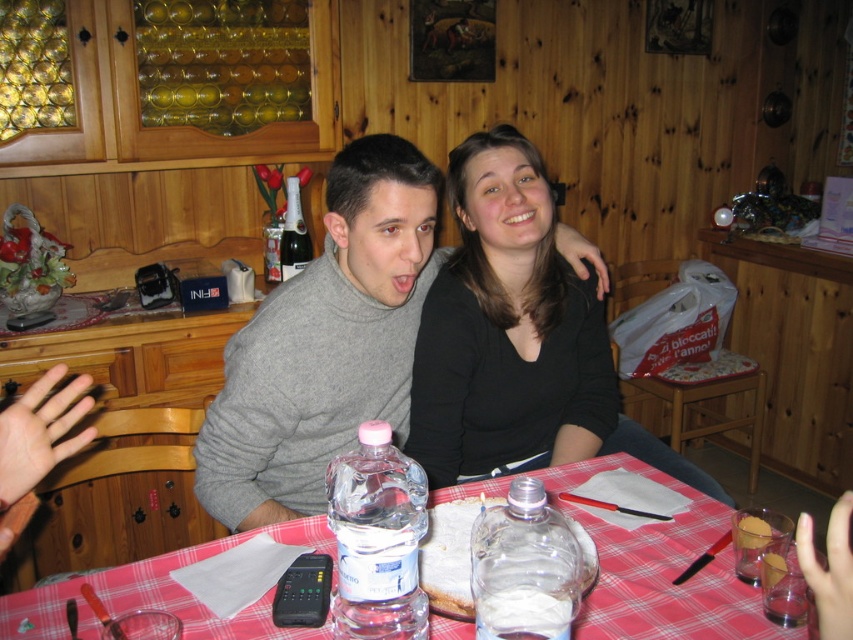
Does point (563, 628) come in front of point (305, 227)?

That is True.

Can you confirm if clear plastic bottle at table center is positioned to the left of black glass bottle at center?

No, clear plastic bottle at table center is not to the left of black glass bottle at center.

Does point (503, 512) come behind point (296, 189)?

No, (503, 512) is closer to viewer.

Locate an element on the screen. The width and height of the screenshot is (853, 640). clear plastic bottle at table center is located at coordinates (524, 566).

Which is in front, point (637, 541) or point (293, 243)?

Point (637, 541) is more forward.

Which is above, checkered fabric tablecloth at center or black glass bottle at center?

black glass bottle at center is above.

Measure the distance between point (801, 632) and camera.

35.33 inches

You are a GUI agent. You are given a task and a screenshot of the screen. Output one action in this format:
    pyautogui.click(x=<x>, y=<y>)
    Task: Click on the checkered fabric tablecloth at center
    The width and height of the screenshot is (853, 640).
    Given the screenshot: What is the action you would take?
    pyautogui.click(x=662, y=570)

Between point (422, 524) and point (289, 269), which one is positioned behind?

Positioned behind is point (289, 269).

Does transparent plastic water bottle at table have a lesser width compared to black glass bottle at center?

No.

Between point (354, 602) and point (305, 241), which one is positioned behind?

Positioned behind is point (305, 241).

You are a GUI agent. You are given a task and a screenshot of the screen. Output one action in this format:
    pyautogui.click(x=<x>, y=<y>)
    Task: Click on the transparent plastic water bottle at table
    Image resolution: width=853 pixels, height=640 pixels.
    Given the screenshot: What is the action you would take?
    pyautogui.click(x=376, y=538)